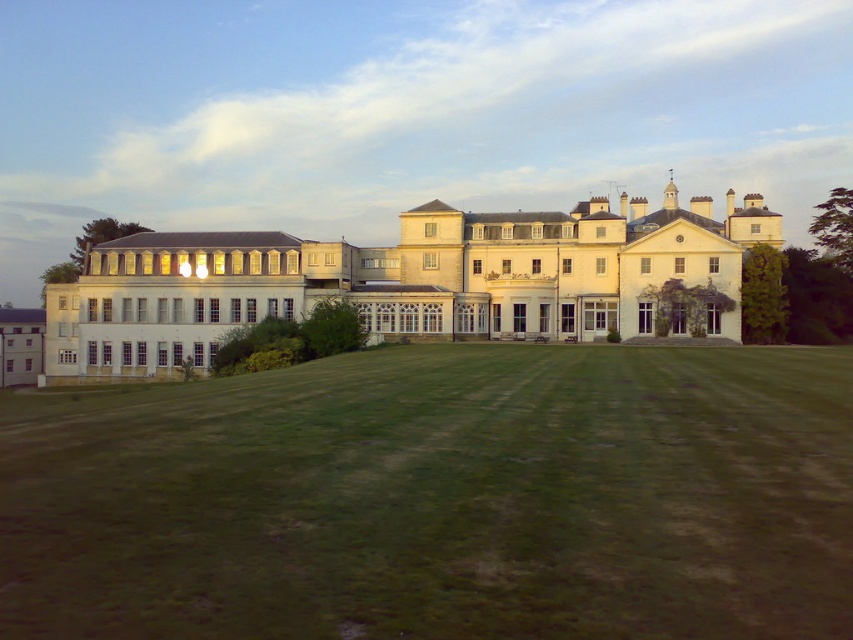
In the scene shown: You are a gardener who wants to mow the lawn. You have a lawnmower that can reach up to 2 meters in height. Considering the green grass at center and the white smooth mansion at center, which object can the lawnmower safely trim without hitting the mansion?

The green grass at center can be safely trimmed by the lawnmower since it has a lesser height compared to the white smooth mansion at center, which is taller and out of the lawnmower reach.

From the picture: You are standing at the point marked by the coordinates point (440, 499) in the image. What do you see directly under your feet?

The point (440, 499) indicates green grass at center, so you are standing on green grass at center.